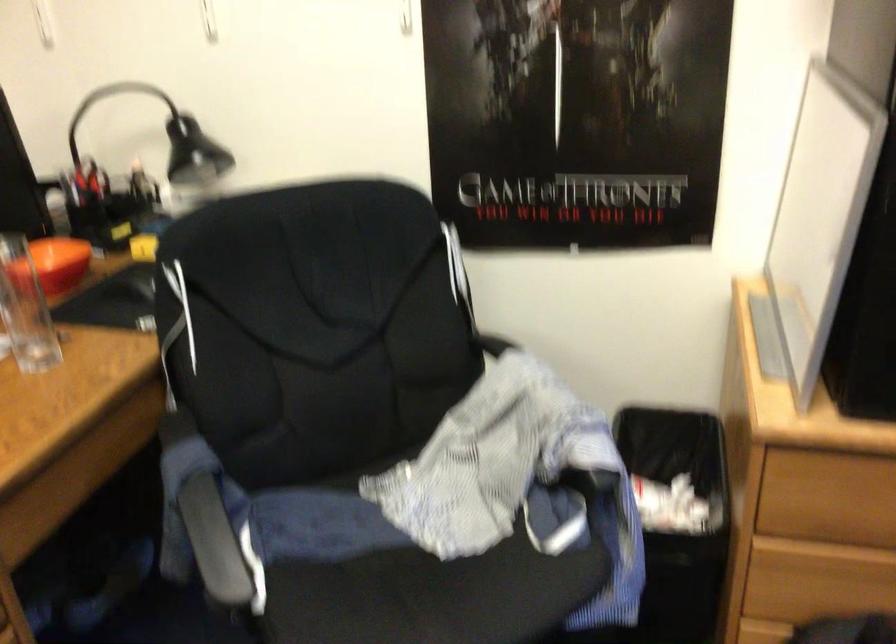
The first image is from the beginning of the video and the second image is from the end. How did the camera likely rotate when shooting the video?

The camera's rotation is toward right-down.